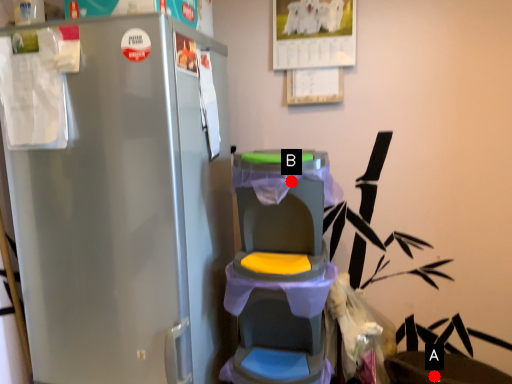
Question: Two points are circled on the image, labeled by A and B beside each circle. Which point appears closest to the camera in this image?

Choices:
 (A) A is closer
 (B) B is closer

Answer: (B)